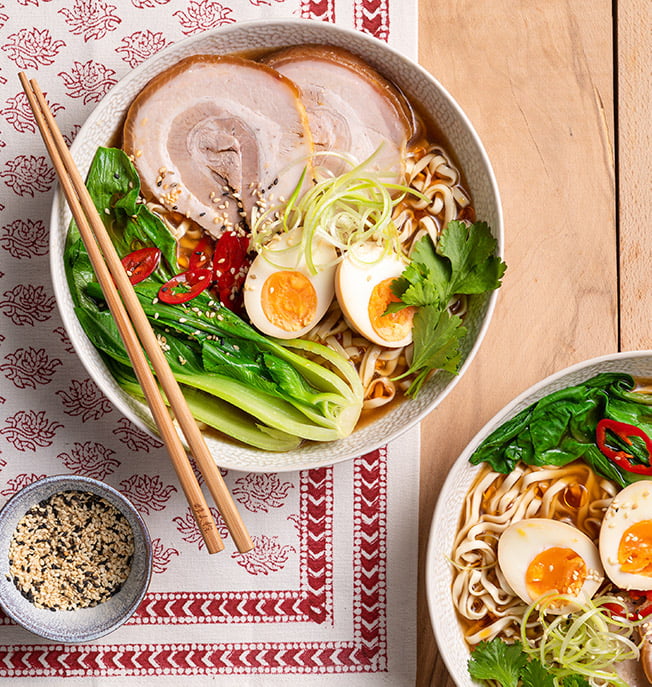
At what (x,y) coordinates should I click in order to perform the action: click on chop sticks. Please return your answer as a coordinate pair (x, y). The width and height of the screenshot is (652, 687). Looking at the image, I should click on (209, 517), (248, 541).